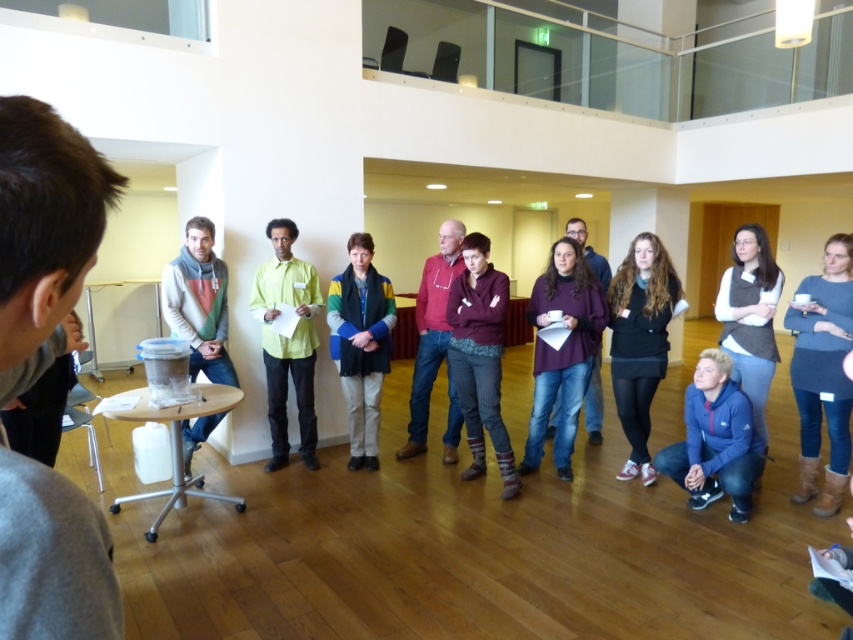
Is green matte shirt at center closer to the viewer compared to matte red hoodie at center?

That is False.

Describe the element at coordinates (287, 340) in the screenshot. I see `green matte shirt at center` at that location.

Find the location of `green matte shirt at center`. green matte shirt at center is located at coordinates tap(287, 340).

Does purple sweater at center have a smaller size compared to green matte shirt at center?

Actually, purple sweater at center might be larger than green matte shirt at center.

At what (x,y) coordinates should I click in order to perform the action: click on purple sweater at center. Please return your answer as a coordinate pair (x, y). Looking at the image, I should click on (561, 352).

The width and height of the screenshot is (853, 640). In order to click on purple sweater at center in this screenshot , I will do `click(561, 352)`.

Is green matte shirt at center bigger than multicolored fabric jacket at center?

Yes, green matte shirt at center is bigger than multicolored fabric jacket at center.

Consider the image. Does green matte shirt at center have a lesser height compared to multicolored fabric jacket at center?

In fact, green matte shirt at center may be taller than multicolored fabric jacket at center.

Who is more forward, (x=312, y=275) or (x=341, y=337)?

Point (x=341, y=337)

Where is `green matte shirt at center`? Image resolution: width=853 pixels, height=640 pixels. green matte shirt at center is located at coordinates (287, 340).